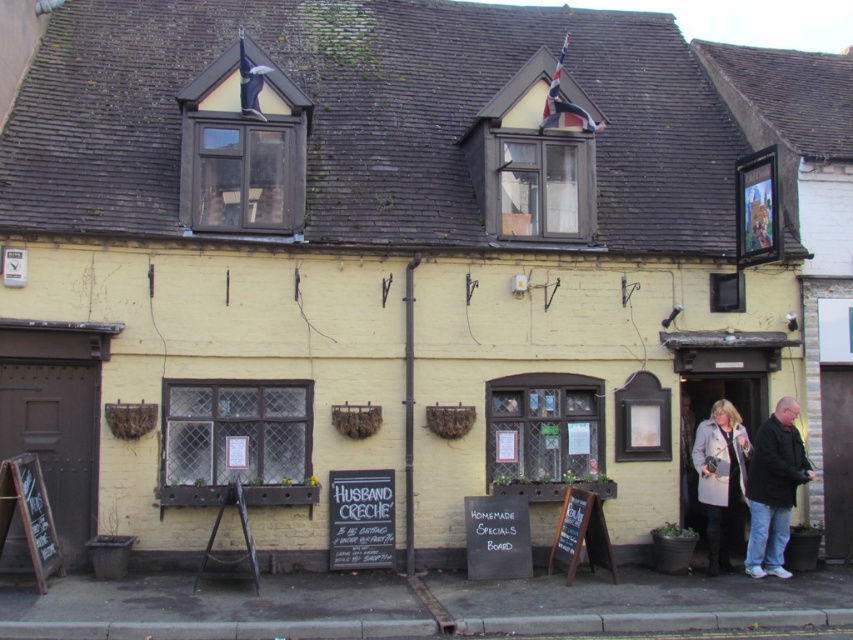
You are standing in front of the building and want to place a new signboard. The signboard must be placed at the same position as the leather jacket at lower right. What are the coordinates where you should place the new signboard?

The coordinates for the leather jacket at lower right are at point (753, 477), so you should place the new signboard at those coordinates.

You are standing in front of the two story building and notice both the gray wool coat at lower right and the wooden chalkboard at lower left. Which object is positioned higher from the ground?

The gray wool coat at lower right is located above the wooden chalkboard at lower left, so it is positioned higher from the ground.